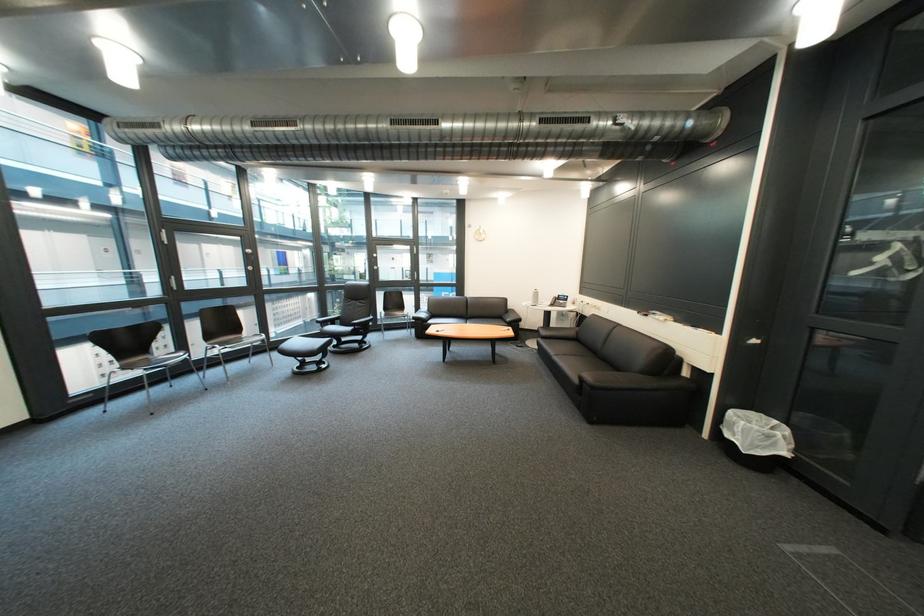
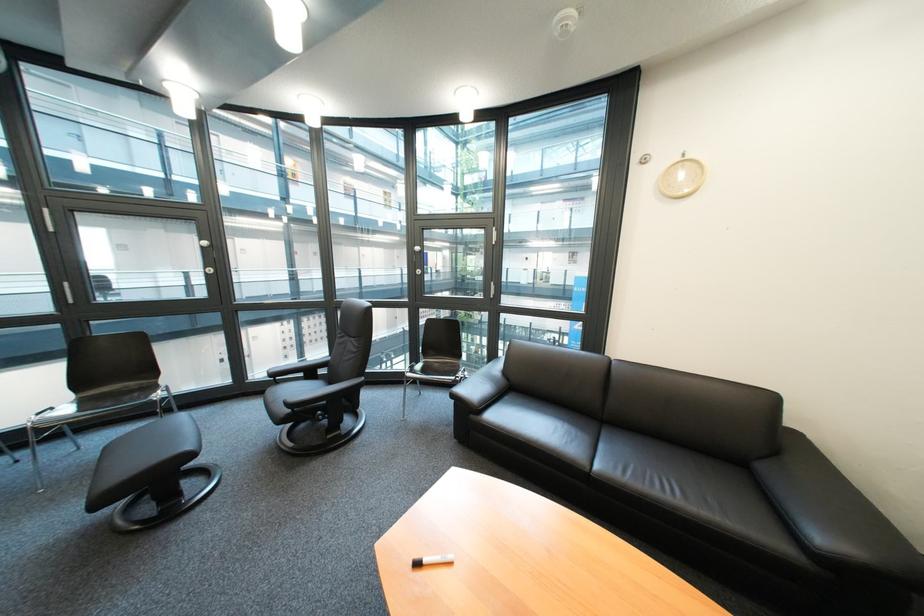
Where in the second image is the point corresponding to (438,325) from the first image?

(485, 418)